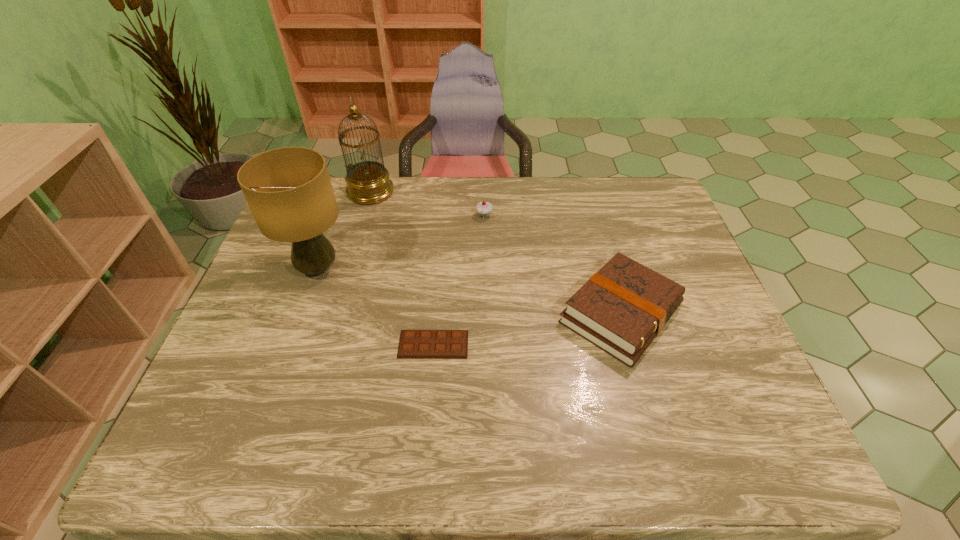
Locate an element on the screen. The image size is (960, 540). free location located on the front of the fourth object from left to right is located at coordinates (485, 249).

I want to click on free spot located on the back of the rightmost object, so click(588, 201).

The image size is (960, 540). Find the location of `vacant space positioned on the right of the chocolate bar`. vacant space positioned on the right of the chocolate bar is located at coordinates coord(585,344).

You are a GUI agent. You are given a task and a screenshot of the screen. Output one action in this format:
    pyautogui.click(x=<x>, y=<y>)
    Task: Click on the birdcage at the far edge
    This screenshot has width=960, height=540.
    Given the screenshot: What is the action you would take?
    (368, 182)

Identify the location of cupcake positioned at the far edge. This screenshot has height=540, width=960. (483, 208).

Image resolution: width=960 pixels, height=540 pixels. In order to click on birdcage at the left edge in this screenshot , I will do `click(368, 182)`.

What are the coordinates of `lampshade situated at the left edge` in the screenshot? It's located at (288, 189).

Find the location of a particular element. The width and height of the screenshot is (960, 540). object situated at the right edge is located at coordinates (621, 309).

Where is `object positioned at the far left corner`? This screenshot has height=540, width=960. object positioned at the far left corner is located at coordinates (368, 182).

At what (x,y) coordinates should I click in order to perform the action: click on vacant space at the far edge. Please return your answer as a coordinate pair (x, y). Looking at the image, I should click on (459, 179).